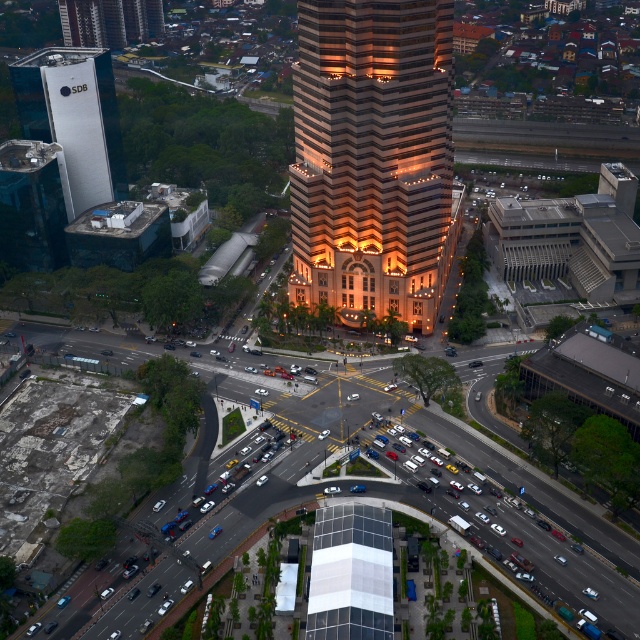
Question: Is golden glass skyscraper at center below matte glass skyscraper at upper left?

Choices:
 (A) yes
 (B) no

Answer: (A)

Question: Can you confirm if golden glass skyscraper at center is positioned to the right of matte glass skyscraper at upper left?

Choices:
 (A) yes
 (B) no

Answer: (A)

Question: Does golden glass skyscraper at center appear on the right side of matte glass skyscraper at upper left?

Choices:
 (A) yes
 (B) no

Answer: (A)